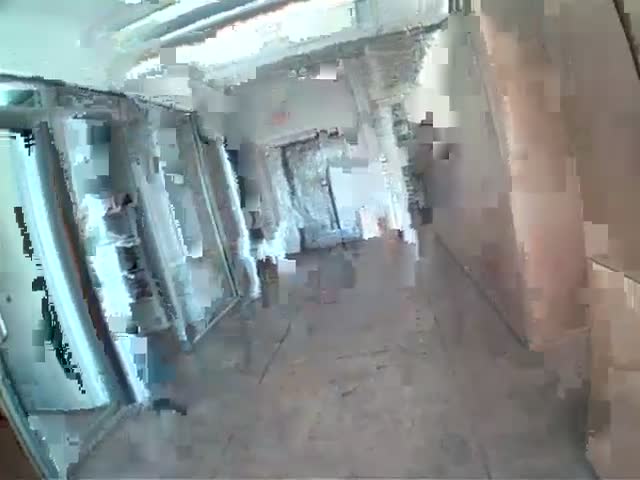
This screenshot has width=640, height=480. In order to click on brow floor in this screenshot , I will do `click(313, 403)`, `click(426, 252)`, `click(269, 272)`, `click(404, 406)`.